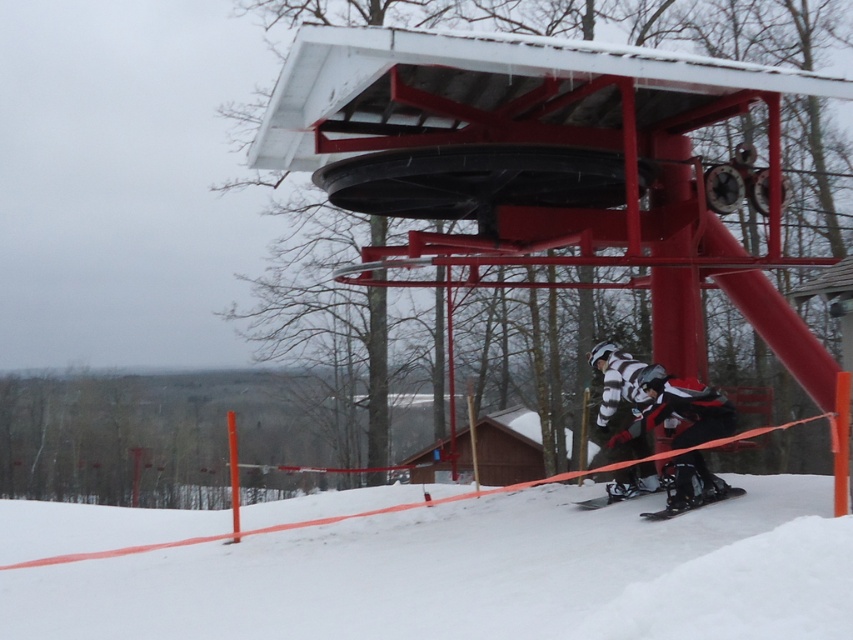
You are a winter sports instructor standing at the base of the red ski lift structure. You need to retrieve both the black matte snowboard at lower center and the shiny black ski at lower center. If your backpack can only carry items within a 1.5 meter reach, can you collect both items without moving your position?

The distance between the black matte snowboard at lower center and the shiny black ski at lower center is 1.40 meters, so yes, you can collect both items without moving your position since the distance is within the 1.5 meter reach of your backpack.

Based on the photo, you are a beginner skier at the resort and want to ensure you have the correct equipment. You see the black matte snowboard at lower center and the shiny black ski at lower center. Which one is located to the right of the other?

The black matte snowboard at lower center is positioned on the right side of the shiny black ski at lower center.

You are standing at point A and want to reach point B. The coordinates of point A are (270,600). The coordinates of point B are 0.621, 0.459. The distance between them is 10.09 meters. You have a snowmobile that can travel 12 meters on a full tank. Do you have enough fuel to go from point A to point B without refueling?

The distance between point A and point B is 10.09 meters. The snowmobile can travel 12 meters on a full tank, so yes, there is enough fuel to go from point A to point B without refueling.